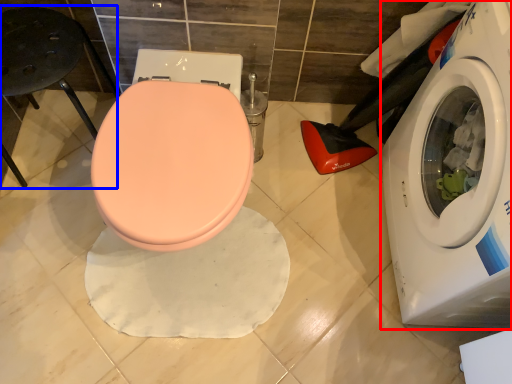
Question: Which object appears farthest to the camera in this image, washing machine (highlighted by a red box) or bar stool (highlighted by a blue box)?

Choices:
 (A) washing machine
 (B) bar stool

Answer: (B)